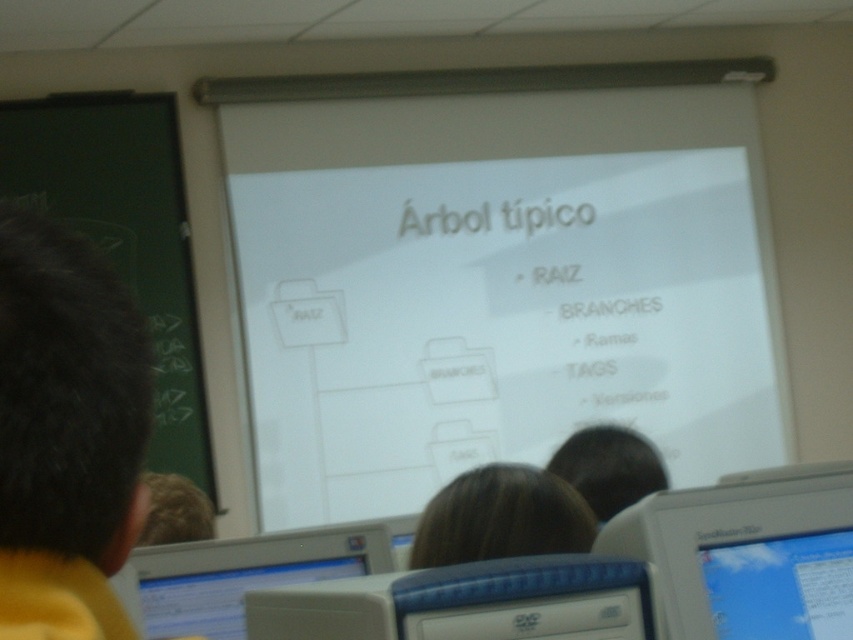
You are a student sitting in the classroom and want to see both the white plastic monitor at lower right and the brown hair at center. Can you see both at the same time without moving your head?

The white plastic monitor at lower right is in front of the brown hair at center, so you cannot see both at the same time without moving your head because the monitor blocks the view of the brown hair at center.

You are a student sitting in the classroom and want to write on the green chalkboard at left. If your arm reaches 1.8 meters, can you reach it from your seat?

The green chalkboard at left is 3.62 meters away from the camera. Since your arm can only reach 1.8 meters, you cannot reach the green chalkboard at left from your seat.

Consider the image. You are a student in the classroom looking at the projection screen. There is a point marked at coordinates (125, 234). Based on the scene description, what object is located at that point?

The point at coordinates (125, 234) corresponds to the green chalkboard at left.